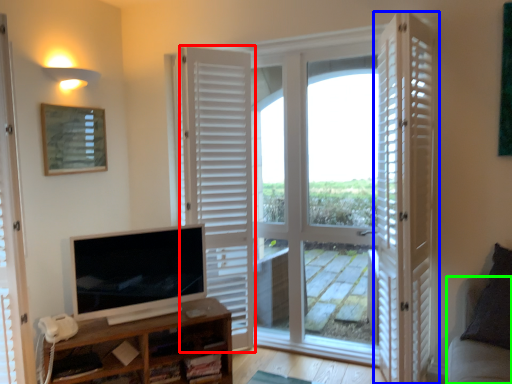
Question: Which is nearer to the door (highlighted by a red box)? door (highlighted by a blue box) or couch (highlighted by a green box).

Choices:
 (A) door
 (B) couch

Answer: (A)